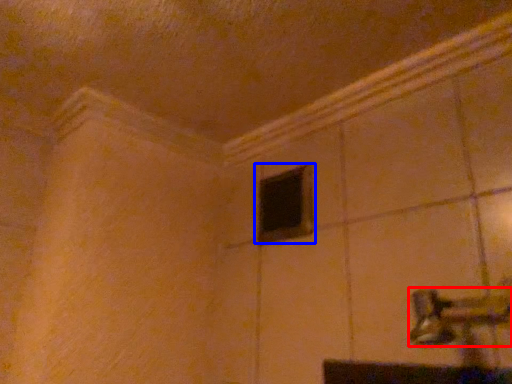
Question: Which object is closer to the camera taking this photo, door handle (highlighted by a red box) or window (highlighted by a blue box)?

Choices:
 (A) door handle
 (B) window

Answer: (A)